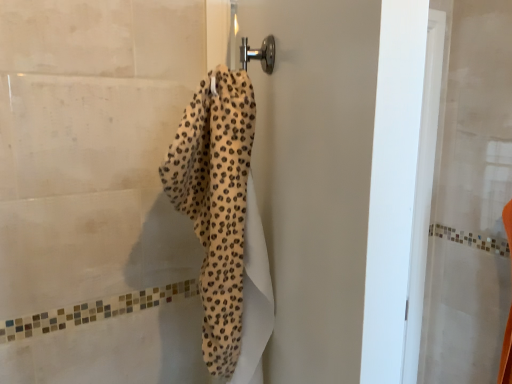
What do you see at coordinates (314, 177) in the screenshot? I see `leopard print towel at center` at bounding box center [314, 177].

Find the location of a particular element. This screenshot has width=512, height=384. leopard print towel at center is located at coordinates (314, 177).

Where is `cheetah print towel at center`? cheetah print towel at center is located at coordinates (224, 222).

What do you see at coordinates (224, 222) in the screenshot? This screenshot has height=384, width=512. I see `cheetah print towel at center` at bounding box center [224, 222].

The width and height of the screenshot is (512, 384). Find the location of `leopard print towel at center`. leopard print towel at center is located at coordinates [314, 177].

Considering the relative positions of leopard print towel at center and cheetah print towel at center in the image provided, is leopard print towel at center to the left of cheetah print towel at center from the viewer's perspective?

Incorrect, leopard print towel at center is not on the left side of cheetah print towel at center.

Who is more distant, leopard print towel at center or cheetah print towel at center?

leopard print towel at center is further away from the camera.

Is point (325, 123) farther from viewer compared to point (197, 128)?

No, (325, 123) is closer to viewer.

From the image's perspective, is leopard print towel at center above or below cheetah print towel at center?

Based on their image positions, leopard print towel at center is located beneath cheetah print towel at center.

From a real-world perspective, is leopard print towel at center physically located above or below cheetah print towel at center?

From a real-world perspective, leopard print towel at center is physically below cheetah print towel at center.

In terms of width, does leopard print towel at center look wider or thinner when compared to cheetah print towel at center?

Considering their sizes, leopard print towel at center looks slimmer than cheetah print towel at center.

Which of these two, leopard print towel at center or cheetah print towel at center, stands shorter?

cheetah print towel at center.

Looking at this image, looking at the image, does leopard print towel at center seem bigger or smaller compared to cheetah print towel at center?

leopard print towel at center is bigger than cheetah print towel at center.

Does leopard print towel at center contain cheetah print towel at center?

That's incorrect, cheetah print towel at center is not inside leopard print towel at center.

Is leopard print towel at center not near cheetah print towel at center?

No, leopard print towel at center is not far away from cheetah print towel at center.

Is leopard print towel at center facing towards cheetah print towel at center?

No, leopard print towel at center is not turned towards cheetah print towel at center.

How different are the orientations of leopard print towel at center and cheetah print towel at center in degrees?

There is a 110-degree angle between the facing directions of leopard print towel at center and cheetah print towel at center.

Measure the distance from leopard print towel at center to cheetah print towel at center.

They are 4.78 inches apart.

Where is `screen door located underneath the cheetah print towel at center (from a real-world perspective)`? This screenshot has width=512, height=384. screen door located underneath the cheetah print towel at center (from a real-world perspective) is located at coordinates (314, 177).

Considering the relative positions of cheetah print towel at center and leopard print towel at center in the image provided, is cheetah print towel at center to the right of leopard print towel at center from the viewer's perspective?

Incorrect, cheetah print towel at center is not on the right side of leopard print towel at center.

Which is in front, cheetah print towel at center or leopard print towel at center?

cheetah print towel at center.

Is point (221, 316) closer to viewer compared to point (291, 196)?

No, it is not.

From the image's perspective, is cheetah print towel at center positioned above or below leopard print towel at center?

cheetah print towel at center is above leopard print towel at center.

From a real-world perspective, between cheetah print towel at center and leopard print towel at center, who is vertically higher?

In real-world perspective, cheetah print towel at center is above.

Considering the sizes of objects cheetah print towel at center and leopard print towel at center in the image provided, who is wider, cheetah print towel at center or leopard print towel at center?

With larger width is cheetah print towel at center.

Considering the sizes of objects cheetah print towel at center and leopard print towel at center in the image provided, who is taller, cheetah print towel at center or leopard print towel at center?

With more height is leopard print towel at center.

Can you confirm if cheetah print towel at center is smaller than leopard print towel at center?

Indeed, cheetah print towel at center has a smaller size compared to leopard print towel at center.

Could leopard print towel at center be considered to be inside cheetah print towel at center?

No, cheetah print towel at center does not contain leopard print towel at center.

In the scene shown: Is cheetah print towel at center beside leopard print towel at center?

No, cheetah print towel at center is not with leopard print towel at center.

In the scene shown: Could you tell me if cheetah print towel at center is turned towards leopard print towel at center?

No, cheetah print towel at center is not oriented towards leopard print towel at center.

How many degrees apart are the facing directions of cheetah print towel at center and leopard print towel at center?

The angular difference between cheetah print towel at center and leopard print towel at center is 110 degrees.

Measure the distance from cheetah print towel at center to leopard print towel at center.

They are 4.78 inches apart.

Locate an element on the screen. Image resolution: width=512 pixels, height=384 pixels. screen door below the cheetah print towel at center (from a real-world perspective) is located at coordinates (314, 177).

Where is `screen door that is on the right side of cheetah print towel at center`? The image size is (512, 384). screen door that is on the right side of cheetah print towel at center is located at coordinates (314, 177).

This screenshot has width=512, height=384. I want to click on screen door that is under the cheetah print towel at center (from a real-world perspective), so click(x=314, y=177).